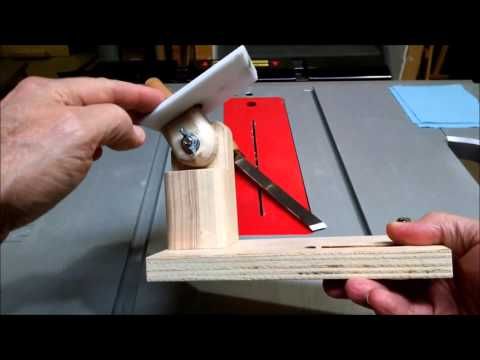
Identify the location of grains on wood. The width and height of the screenshot is (480, 360). (189, 202), (183, 203), (180, 202), (194, 203), (183, 257), (186, 268), (314, 271), (334, 262), (329, 256).